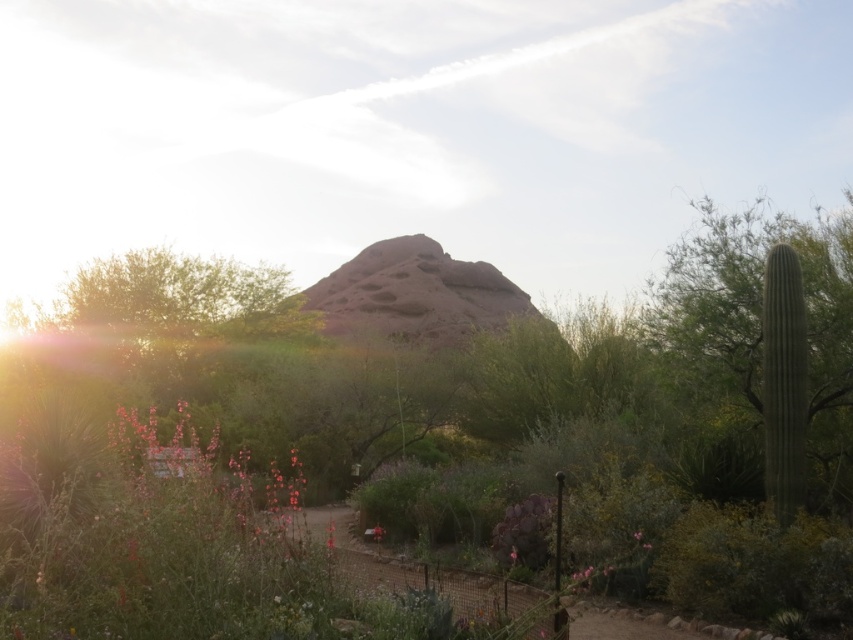
You are a botanist studying desert flora. You observe the rustic rock formation at center and the green matte flower at center in the image. Which object is positioned higher in the scene?

The rustic rock formation at center is located above the green matte flower at center, so it is positioned higher in the scene.

You are a desert explorer trying to navigate between two green plants at the center of the desert scene. The plants are the green leafy bush at center and the green matte flower at center. Which plant should you avoid stepping on if the path is narrower than the plant?

You should avoid stepping on the green leafy bush at center because it might be wider than the green matte flower at center, making it harder to navigate around if the path is narrow.